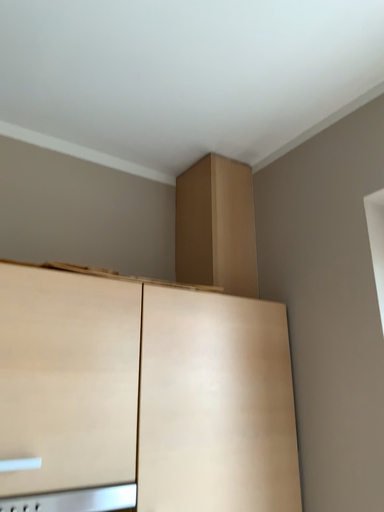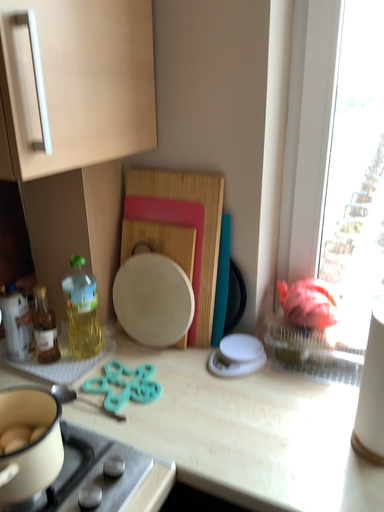
Question: How did the camera likely rotate when shooting the video?

Choices:
 (A) rotated left
 (B) rotated right

Answer: (B)